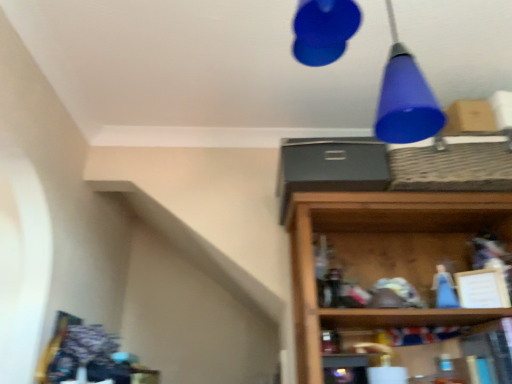
This screenshot has height=384, width=512. What do you see at coordinates (405, 98) in the screenshot? I see `matte blue cone at upper right` at bounding box center [405, 98].

Where is `matte blue cone at upper right`? This screenshot has width=512, height=384. matte blue cone at upper right is located at coordinates (405, 98).

Find the location of a particular element. The width and height of the screenshot is (512, 384). matte blue cone at upper right is located at coordinates (405, 98).